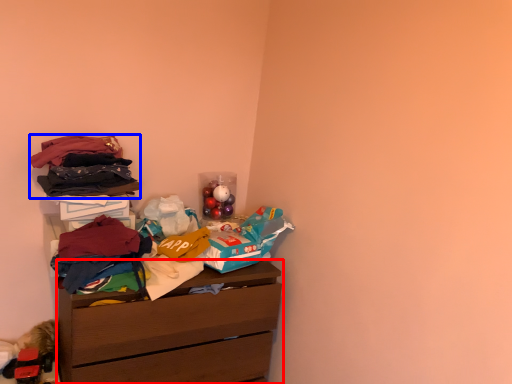
Question: Which of the following is the farthest to the observer, chest of drawers (highlighted by a red box) or clothing (highlighted by a blue box)?

Choices:
 (A) chest of drawers
 (B) clothing

Answer: (B)